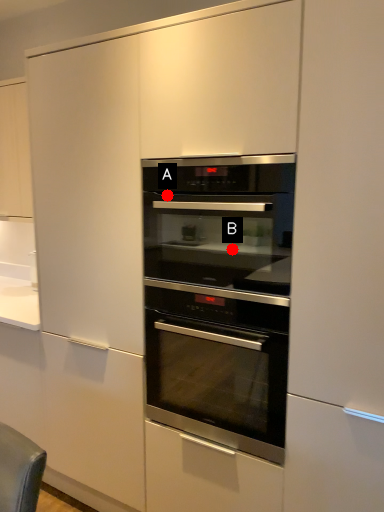
Question: Two points are circled on the image, labeled by A and B beside each circle. Which point is closer to the camera taking this photo?

Choices:
 (A) A is closer
 (B) B is closer

Answer: (B)